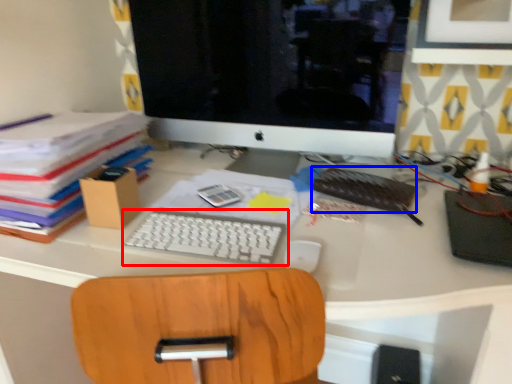
Question: Which object is closer to the camera taking this photo, computer keyboard (highlighted by a red box) or notebook (highlighted by a blue box)?

Choices:
 (A) computer keyboard
 (B) notebook

Answer: (A)